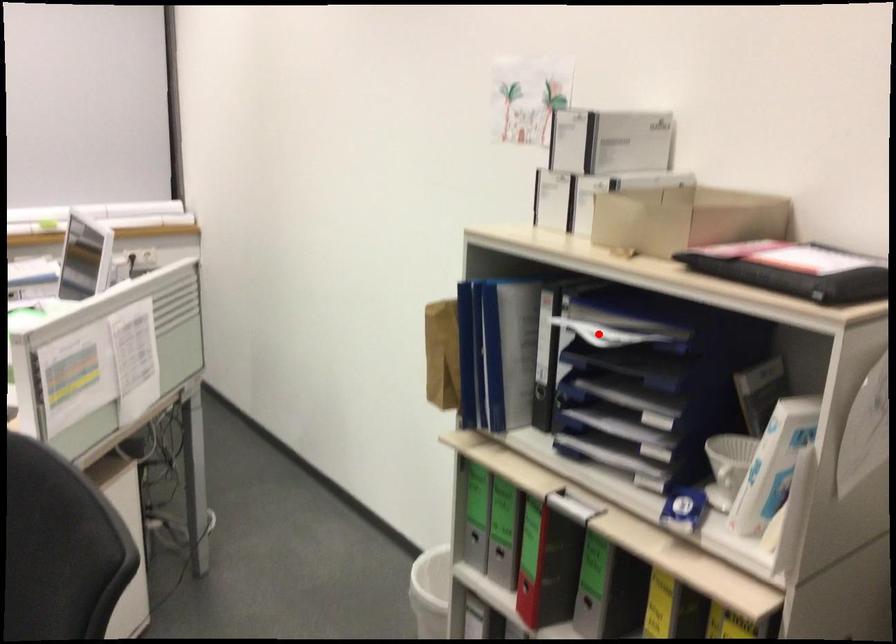
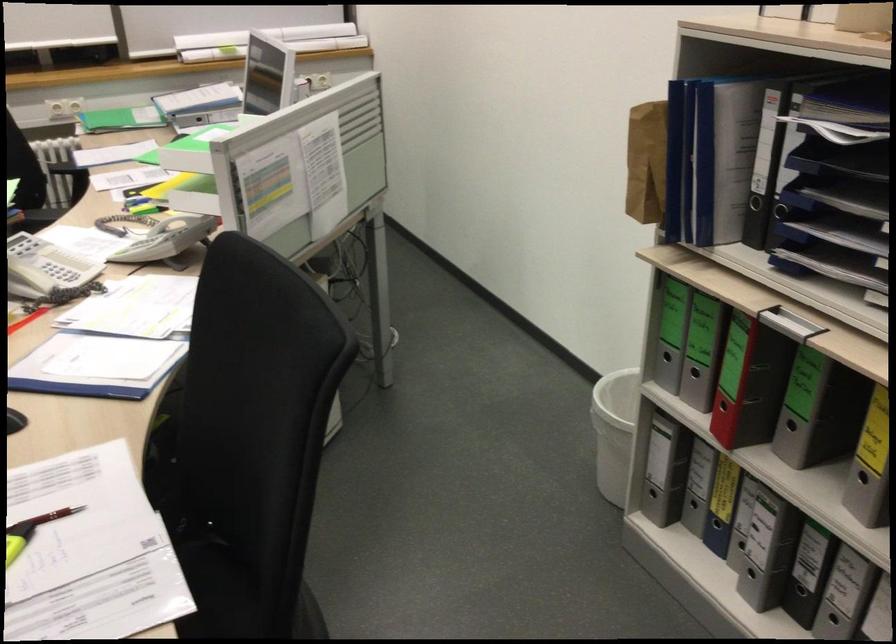
Question: I am providing you with two images of the same scene from different viewpoints. A red point is shown in image1. For the corresponding object point in image2, is it positioned nearer or farther from the camera?

Choices:
 (A) Nearer
 (B) Farther

Answer: (A)